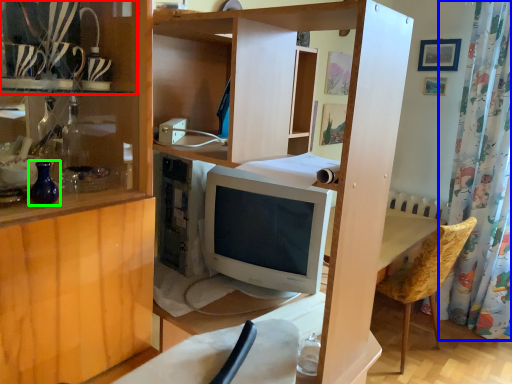
Question: Based on their relative distances, which object is nearer to shelf (highlighted by a red box)? Choose from shower curtain (highlighted by a blue box) and glass vase (highlighted by a green box).

Choices:
 (A) shower curtain
 (B) glass vase

Answer: (B)